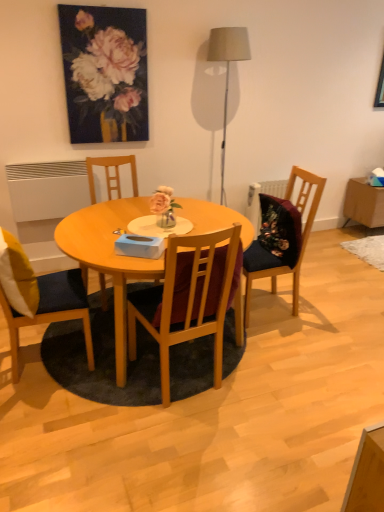
Where is `free location in front of light brown wooden table at center`? free location in front of light brown wooden table at center is located at coordinates tap(167, 446).